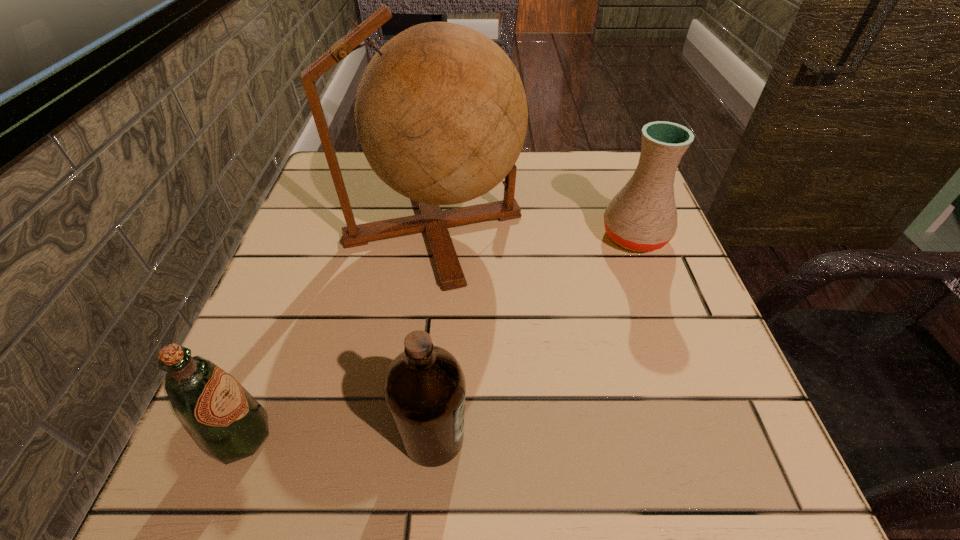
Locate an element on the screen. The width and height of the screenshot is (960, 540). vacant space at the far right corner of the desktop is located at coordinates (608, 174).

Find the location of a particular element. This screenshot has width=960, height=540. free space that is in between the right olive oil and the rightmost object is located at coordinates (534, 336).

Where is `vacant space that is in between the globe and the rightmost object`? Image resolution: width=960 pixels, height=540 pixels. vacant space that is in between the globe and the rightmost object is located at coordinates (535, 231).

You are a GUI agent. You are given a task and a screenshot of the screen. Output one action in this format:
    pyautogui.click(x=<x>, y=<y>)
    Task: Click on the free area in between the rightmost object and the globe
    The image size is (960, 540).
    Given the screenshot: What is the action you would take?
    pyautogui.click(x=535, y=231)

I want to click on vacant space that's between the left olive oil and the right olive oil, so click(x=337, y=437).

You are a GUI agent. You are given a task and a screenshot of the screen. Output one action in this format:
    pyautogui.click(x=<x>, y=<y>)
    Task: Click on the free space between the pottery and the globe
    Image resolution: width=960 pixels, height=540 pixels.
    Given the screenshot: What is the action you would take?
    pyautogui.click(x=535, y=231)

This screenshot has height=540, width=960. I want to click on vacant region between the pottery and the tallest object, so click(x=535, y=231).

The width and height of the screenshot is (960, 540). In order to click on free space between the left olive oil and the right olive oil in this screenshot , I will do `click(337, 437)`.

Locate an element on the screen. unoccupied area between the rightmost object and the tallest object is located at coordinates (535, 231).

At what (x,y) coordinates should I click in order to perform the action: click on free space that is in between the rightmost object and the globe. Please return your answer as a coordinate pair (x, y). Looking at the image, I should click on (535, 231).